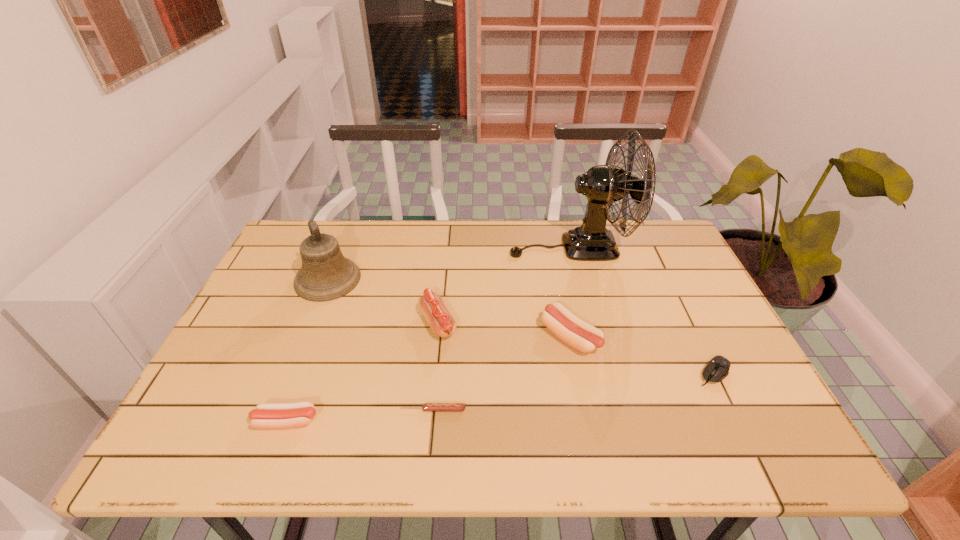
Identify which sausage is the nearest to the fan. Please provide its 2D coordinates. Your answer should be formatted as a tuple, i.e. [(x, y)], where the tuple contains the x and y coordinates of a point satisfying the conditions above.

[(582, 336)]

Locate an element on the screen. free space that satisfies the following two spatial constraints: 1. on the back side of the third shortest object; 2. on the left side of the rightmost object is located at coordinates (304, 373).